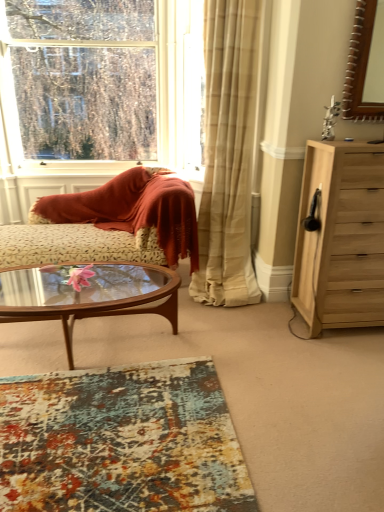
Question: Is point (33, 254) positioned closer to the camera than point (211, 23)?

Choices:
 (A) closer
 (B) farther

Answer: (B)

Question: From a real-world perspective, is floral-patterned fabric couch at center physically located above or below beige plaid curtain at center?

Choices:
 (A) below
 (B) above

Answer: (A)

Question: Estimate the real-world distances between objects in this image. Which object is farther from the clear glass window at upper left?

Choices:
 (A) wooden mirror at upper right
 (B) light wood chest of drawers at right
 (C) textured multicolored rug at lower center
 (D) beige plaid curtain at center
 (E) floral-patterned fabric couch at center

Answer: (C)

Question: Based on their relative distances, which object is nearer to the textured multicolored rug at lower center?

Choices:
 (A) clear glass window at upper left
 (B) floral-patterned fabric couch at center
 (C) wooden mirror at upper right
 (D) beige plaid curtain at center
 (E) transparent glass coffee table at center

Answer: (E)